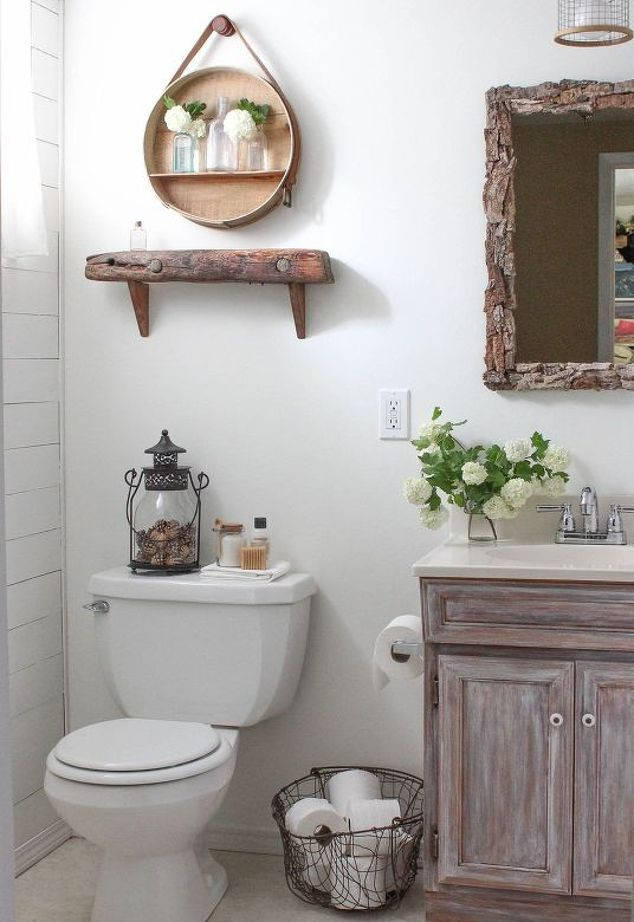
Where is `the left side wall`? the left side wall is located at coordinates (44, 15), (30, 629), (34, 692), (40, 430).